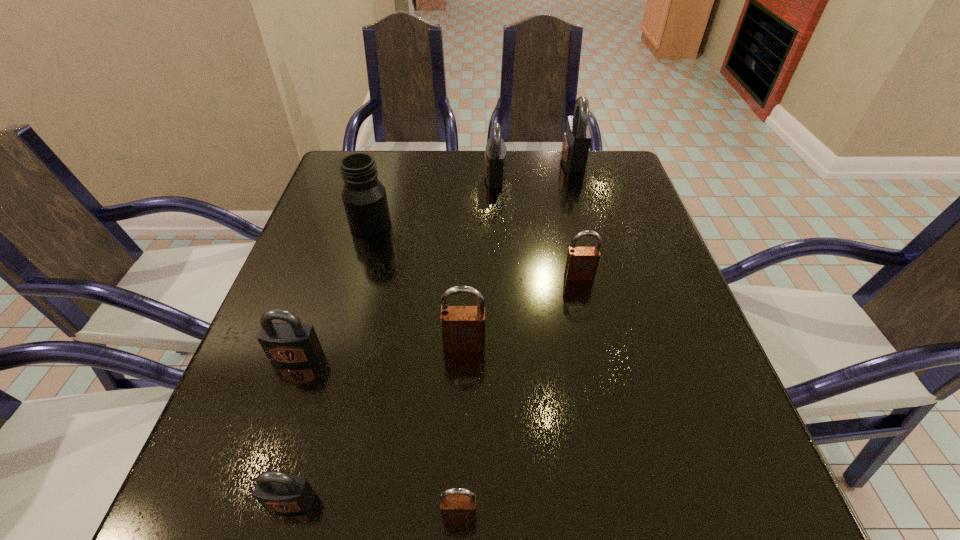
Find the location of a particular element. Image resolution: width=960 pixels, height=540 pixels. the biggest gray padlock is located at coordinates (577, 136).

Find the location of a particular element. The width and height of the screenshot is (960, 540). the tallest padlock is located at coordinates 577,136.

Locate an element on the screen. jar is located at coordinates (364, 197).

Find the location of a particular element. the fifth padlock from left to right is located at coordinates [495, 153].

You are a GUI agent. You are given a task and a screenshot of the screen. Output one action in this format:
    pyautogui.click(x=<x>, y=<y>)
    Task: Click on the third object from right to left
    The height and width of the screenshot is (540, 960).
    Given the screenshot: What is the action you would take?
    pyautogui.click(x=495, y=153)

You are a GUI agent. You are given a task and a screenshot of the screen. Output one action in this format:
    pyautogui.click(x=<x>, y=<y>)
    Task: Click on the biggest brown padlock
    Image resolution: width=960 pixels, height=540 pixels.
    Given the screenshot: What is the action you would take?
    pyautogui.click(x=463, y=327)

Locate an element on the screen. This screenshot has height=540, width=960. the farthest brown padlock is located at coordinates (582, 262).

Locate an element on the screen. the fifth nearest object is located at coordinates (582, 262).

At what (x,y) coordinates should I click in order to perform the action: click on the second nearest gray padlock. Please return your answer as a coordinate pair (x, y). Image resolution: width=960 pixels, height=540 pixels. Looking at the image, I should click on (292, 342).

Locate an element on the screen. the nearest gray padlock is located at coordinates (276, 491).